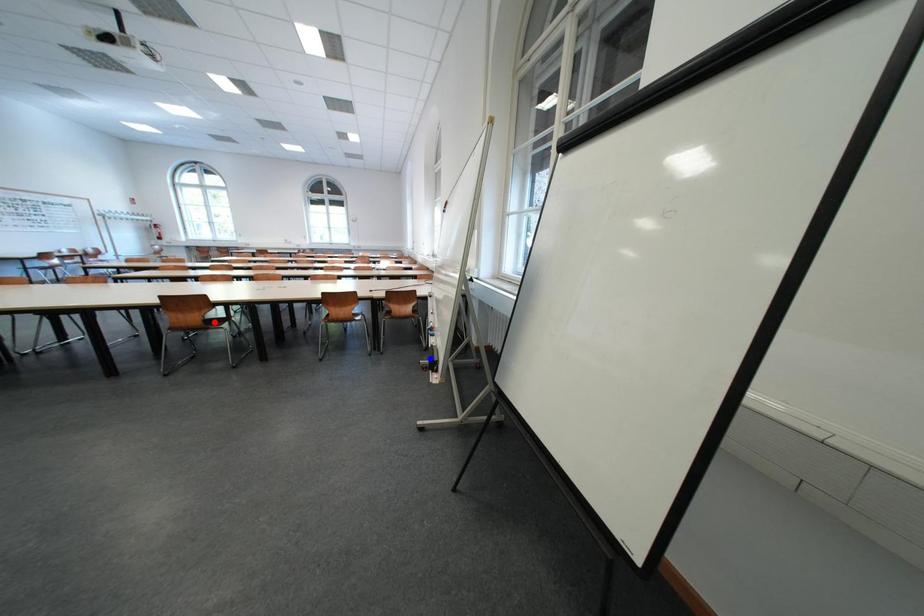
Question: In the image, two points are highlighted. Which point is nearer to the camera? Reply with the corresponding letter.

Choices:
 (A) blue point
 (B) red point

Answer: (A)